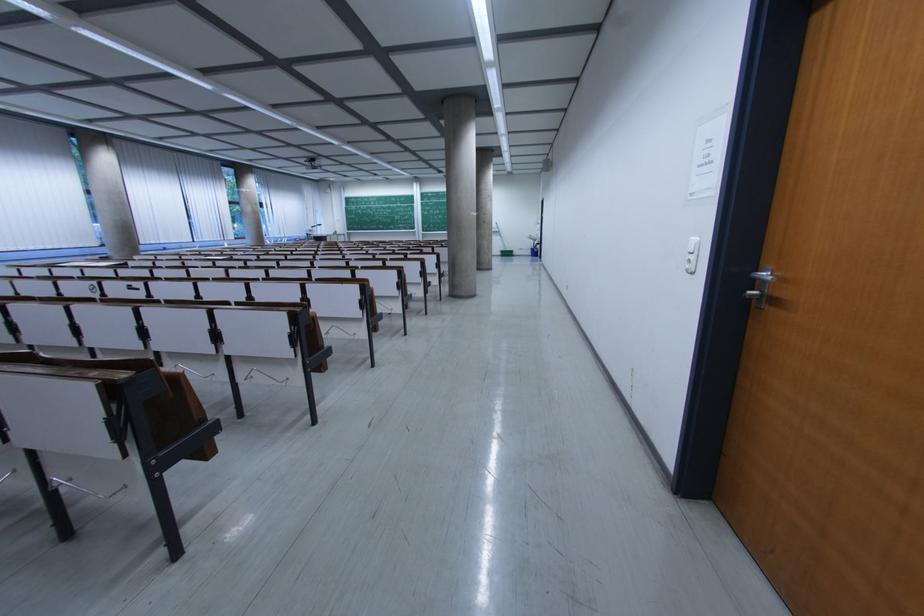
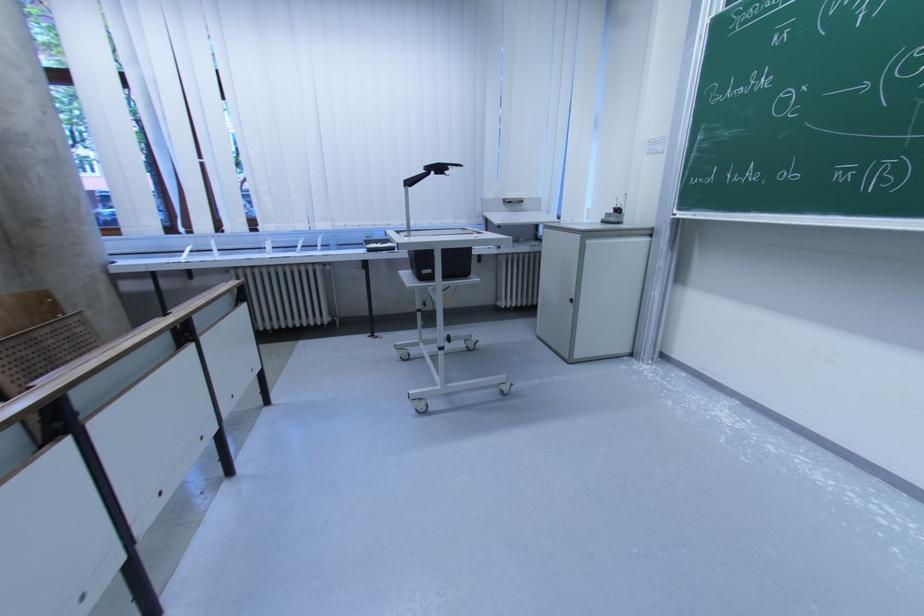
Where in the second image is the point corresponding to (x=317, y=229) from the first image?

(415, 185)